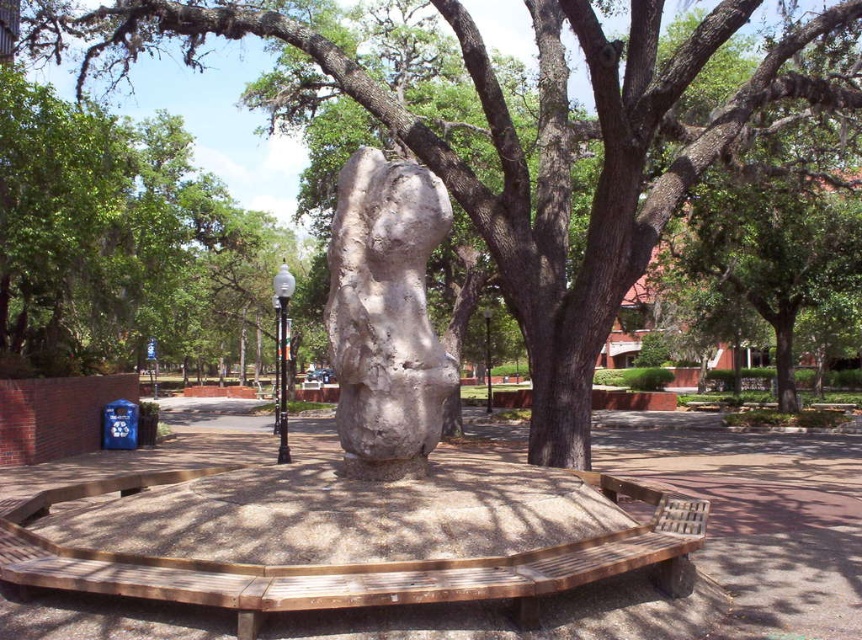
Does wooden bench at center appear on the left side of white stone sculpture at center?

Correct, you'll find wooden bench at center to the left of white stone sculpture at center.

Is wooden bench at center closer to the viewer compared to white stone sculpture at center?

Yes, wooden bench at center is in front of white stone sculpture at center.

Between point (228, 582) and point (411, 292), which one is positioned in front?

Point (228, 582)

You are a GUI agent. You are given a task and a screenshot of the screen. Output one action in this format:
    pyautogui.click(x=<x>, y=<y>)
    Task: Click on the wooden bench at center
    This screenshot has height=640, width=862.
    Given the screenshot: What is the action you would take?
    pyautogui.click(x=366, y=561)

From the picture: Between green leafy tree at center and wooden bench at center, which one appears on the left side from the viewer's perspective?

Positioned to the left is wooden bench at center.

Can you confirm if green leafy tree at center is thinner than wooden bench at center?

No.

Who is more forward, (609, 186) or (203, 577)?

Point (203, 577) is more forward.

At what (x,y) coordinates should I click in order to perform the action: click on green leafy tree at center. Please return your answer as a coordinate pair (x, y). Image resolution: width=862 pixels, height=640 pixels. Looking at the image, I should click on (522, 150).

Does green leafy tree at center have a lesser width compared to white stone sculpture at center?

No, green leafy tree at center is not thinner than white stone sculpture at center.

Does point (714, 116) lie in front of point (423, 289)?

No.

Find the location of `green leafy tree at center`. green leafy tree at center is located at coordinates (522, 150).